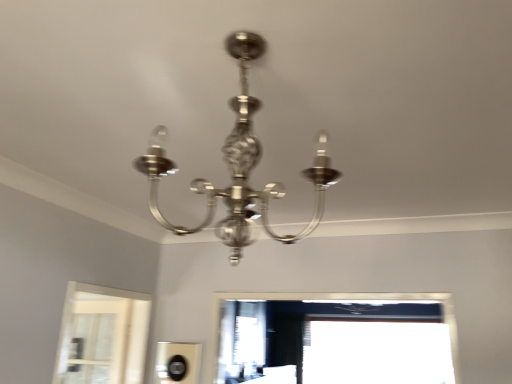
What do you see at coordinates (377, 353) in the screenshot? This screenshot has width=512, height=384. I see `transparent glass window at lower right` at bounding box center [377, 353].

Locate an element on the screen. Image resolution: width=512 pixels, height=384 pixels. transparent glass window at lower right is located at coordinates (377, 353).

The height and width of the screenshot is (384, 512). Describe the element at coordinates (238, 167) in the screenshot. I see `polished silver chandelier at center` at that location.

What is the approximate width of polished silver chandelier at center?

It is 16.61 inches.

Identify the location of polished silver chandelier at center. The image size is (512, 384). (238, 167).

This screenshot has width=512, height=384. In order to click on transparent glass window at lower right in this screenshot , I will do `click(377, 353)`.

Considering the relative positions of transparent glass window at lower right and polished silver chandelier at center in the image provided, is transparent glass window at lower right to the right of polished silver chandelier at center from the viewer's perspective?

Indeed, transparent glass window at lower right is positioned on the right side of polished silver chandelier at center.

Considering the relative positions of transparent glass window at lower right and polished silver chandelier at center in the image provided, is transparent glass window at lower right in front of polished silver chandelier at center?

No, transparent glass window at lower right is further to the viewer.

Which is closer, (447, 381) or (241, 124)?

Point (447, 381).

From the image's perspective, is transparent glass window at lower right on top of polished silver chandelier at center?

No, from the image's perspective, transparent glass window at lower right is not on top of polished silver chandelier at center.

From a real-world perspective, relative to polished silver chandelier at center, is transparent glass window at lower right vertically above or below?

From a real-world perspective, transparent glass window at lower right is physically below polished silver chandelier at center.

In terms of width, does transparent glass window at lower right look wider or thinner when compared to polished silver chandelier at center?

Clearly, transparent glass window at lower right has less width compared to polished silver chandelier at center.

Considering the sizes of objects transparent glass window at lower right and polished silver chandelier at center in the image provided, who is shorter, transparent glass window at lower right or polished silver chandelier at center?

Standing shorter between the two is polished silver chandelier at center.

Does transparent glass window at lower right have a larger size compared to polished silver chandelier at center?

Indeed, transparent glass window at lower right has a larger size compared to polished silver chandelier at center.

Which is correct: transparent glass window at lower right is inside polished silver chandelier at center, or outside of it?

transparent glass window at lower right is spatially situated outside polished silver chandelier at center.

Is transparent glass window at lower right far from polished silver chandelier at center?

transparent glass window at lower right is positioned a significant distance from polished silver chandelier at center.

Could you tell me if transparent glass window at lower right is turned towards polished silver chandelier at center?

Yes, transparent glass window at lower right is turned towards polished silver chandelier at center.

Measure the distance from transparent glass window at lower right to polished silver chandelier at center.

transparent glass window at lower right is 3.59 meters away from polished silver chandelier at center.

Image resolution: width=512 pixels, height=384 pixels. Identify the location of lamp above the transparent glass window at lower right (from a real-world perspective). (238, 167).

Is polished silver chandelier at center at the right side of transparent glass window at lower right?

In fact, polished silver chandelier at center is to the left of transparent glass window at lower right.

Considering their positions, is polished silver chandelier at center located in front of or behind transparent glass window at lower right?

polished silver chandelier at center is positioned closer to the viewer than transparent glass window at lower right.

Which is behind, point (245, 67) or point (414, 334)?

Point (414, 334)

From the image's perspective, which one is positioned higher, polished silver chandelier at center or transparent glass window at lower right?

polished silver chandelier at center.

From a real-world perspective, who is located lower, polished silver chandelier at center or transparent glass window at lower right?

In real-world perspective, transparent glass window at lower right is lower.

Between polished silver chandelier at center and transparent glass window at lower right, which one has smaller width?

transparent glass window at lower right is thinner.

Who is shorter, polished silver chandelier at center or transparent glass window at lower right?

Standing shorter between the two is polished silver chandelier at center.

Considering the relative sizes of polished silver chandelier at center and transparent glass window at lower right in the image provided, is polished silver chandelier at center smaller than transparent glass window at lower right?

Yes.

Is polished silver chandelier at center spatially inside transparent glass window at lower right, or outside of it?

The correct answer is: outside.

Is polished silver chandelier at center directly adjacent to transparent glass window at lower right?

No, polished silver chandelier at center is not next to transparent glass window at lower right.

Based on the photo, is polished silver chandelier at center facing towards transparent glass window at lower right?

Yes.

How many degrees apart are the facing directions of polished silver chandelier at center and transparent glass window at lower right?

174 degrees separate the facing orientations of polished silver chandelier at center and transparent glass window at lower right.

Identify the location of window on the right of the polished silver chandelier at center. The width and height of the screenshot is (512, 384). click(x=377, y=353).

In the image, there is a polished silver chandelier at center. Where is `window below it (from a real-world perspective)`? window below it (from a real-world perspective) is located at coordinates point(377,353).

Identify the location of window behind the polished silver chandelier at center. Image resolution: width=512 pixels, height=384 pixels. (377, 353).